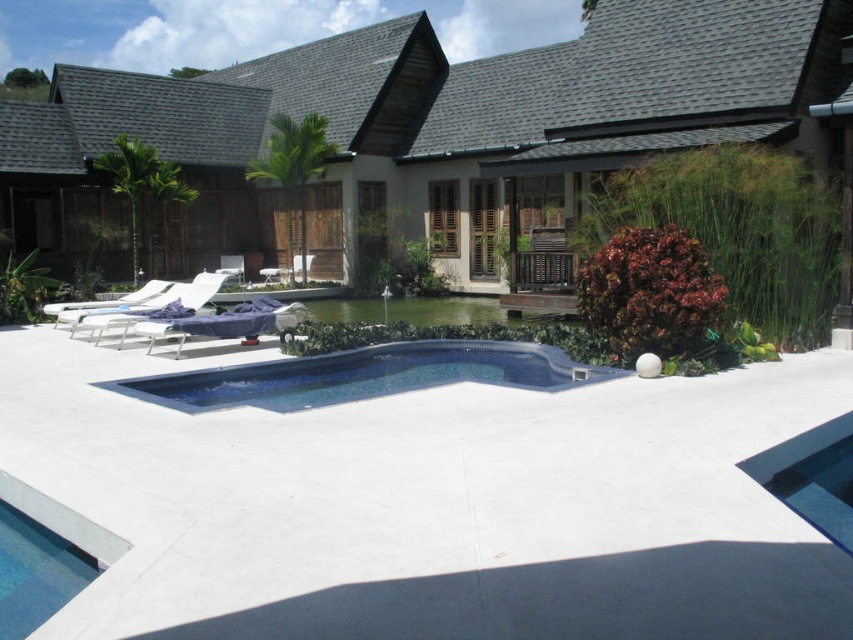
You are planning to install a new lighting system around the pool area. Based on the image, which object is positioned behind the other between the smooth concrete pool at center and the blue glossy swimming pool at center?

The blue glossy swimming pool at center is positioned behind the smooth concrete pool at center.

You are planning to place a floating solar cover on the pool. Which pool should you place it on, the smooth concrete pool at center or the blue glossy swimming pool at center?

The blue glossy swimming pool at center is the actual water pool, so you should place the floating solar cover on the blue glossy swimming pool at center.

You are standing at the edge of the deck and want to throw a ball into the smooth concrete pool at center. If you can throw a ball 10 meters, will it reach the pool?

The smooth concrete pool at center is 10.05 meters away from the camera. Since the throwing distance is slightly beyond your 10 meter limit, the ball will not reach the pool.